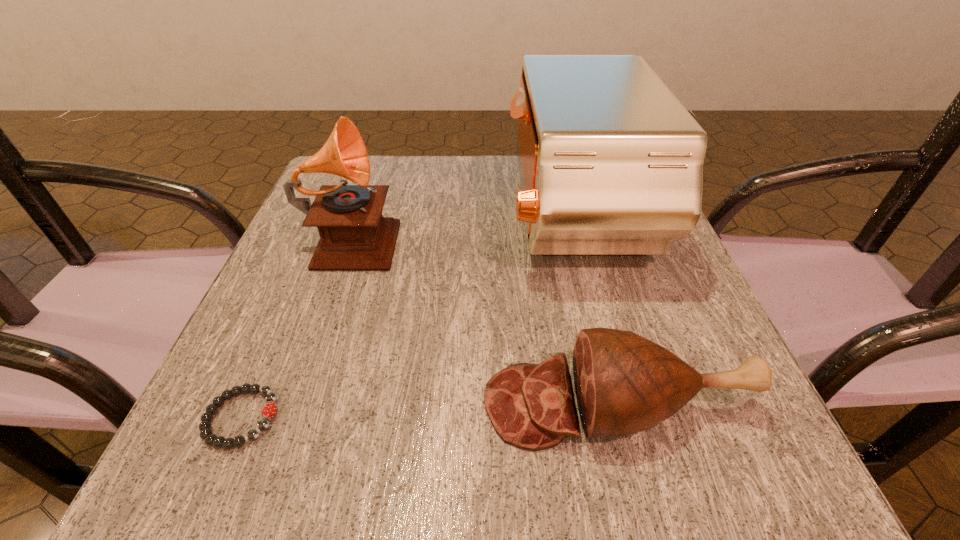
Where is `vacant point located between the second shortest object and the phonograph record`? vacant point located between the second shortest object and the phonograph record is located at coordinates (485, 320).

Where is `vacant space that's between the phonograph record and the toaster oven`? This screenshot has height=540, width=960. vacant space that's between the phonograph record and the toaster oven is located at coordinates tap(463, 226).

At what (x,y) coordinates should I click in order to perform the action: click on vacant area that lies between the phonograph record and the shortest object. Please return your answer as a coordinate pair (x, y). The image size is (960, 540). Looking at the image, I should click on (297, 327).

Where is `free point between the second shortest object and the phonograph record`? The image size is (960, 540). free point between the second shortest object and the phonograph record is located at coordinates (485, 320).

At what (x,y) coordinates should I click in order to perform the action: click on free space between the ham and the toaster oven. Please return your answer as a coordinate pair (x, y). Looking at the image, I should click on (594, 310).

At what (x,y) coordinates should I click in order to perform the action: click on free area in between the bracelet and the toaster oven. Please return your answer as a coordinate pair (x, y). The image size is (960, 540). Looking at the image, I should click on (407, 317).

The width and height of the screenshot is (960, 540). I want to click on unoccupied position between the ham and the shortest object, so click(x=428, y=411).

Where is `vacant point located between the toaster oven and the phonograph record`? The image size is (960, 540). vacant point located between the toaster oven and the phonograph record is located at coordinates (463, 226).

Identify which object is the closest to the toaster oven. Please provide its 2D coordinates. Your answer should be formatted as a tuple, i.e. [(x, y)], where the tuple contains the x and y coordinates of a point satisfying the conditions above.

[(624, 383)]

Select which object appears as the closest to the ham. Please provide its 2D coordinates. Your answer should be formatted as a tuple, i.e. [(x, y)], where the tuple contains the x and y coordinates of a point satisfying the conditions above.

[(611, 163)]